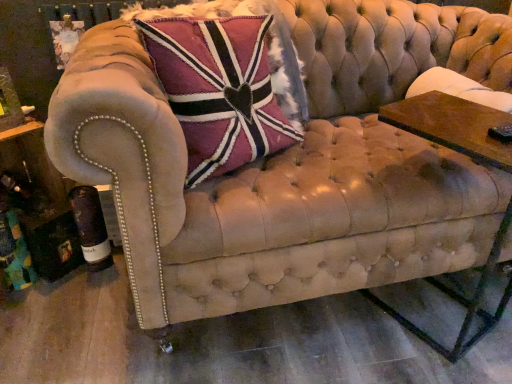
Question: From a real-world perspective, is wooden rectangular table at right above or below velvet union jack pillow at upper left?

Choices:
 (A) below
 (B) above

Answer: (A)

Question: Looking at their shapes, would you say wooden rectangular table at right is wider or thinner than velvet union jack pillow at upper left?

Choices:
 (A) thin
 (B) wide

Answer: (B)

Question: Is wooden rectangular table at right bigger or smaller than velvet union jack pillow at upper left?

Choices:
 (A) big
 (B) small

Answer: (B)

Question: From the image's perspective, is velvet union jack pillow at upper left positioned above or below wooden rectangular table at right?

Choices:
 (A) below
 (B) above

Answer: (B)

Question: Considering the relative positions of velvet union jack pillow at upper left and wooden rectangular table at right in the image provided, is velvet union jack pillow at upper left to the left or to the right of wooden rectangular table at right?

Choices:
 (A) right
 (B) left

Answer: (B)

Question: Would you say velvet union jack pillow at upper left is inside or outside wooden rectangular table at right?

Choices:
 (A) inside
 (B) outside

Answer: (B)

Question: From their relative heights in the image, would you say velvet union jack pillow at upper left is taller or shorter than wooden rectangular table at right?

Choices:
 (A) tall
 (B) short

Answer: (B)